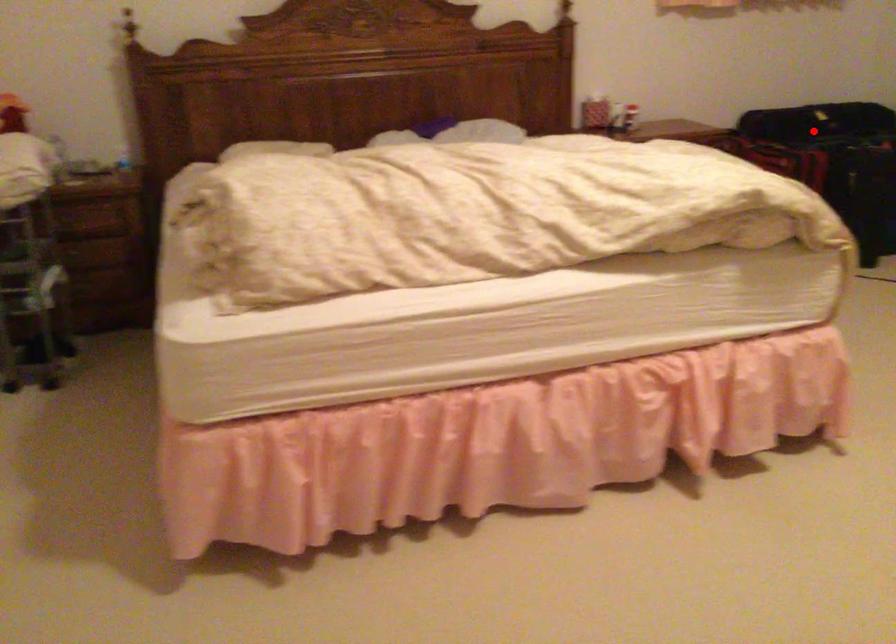
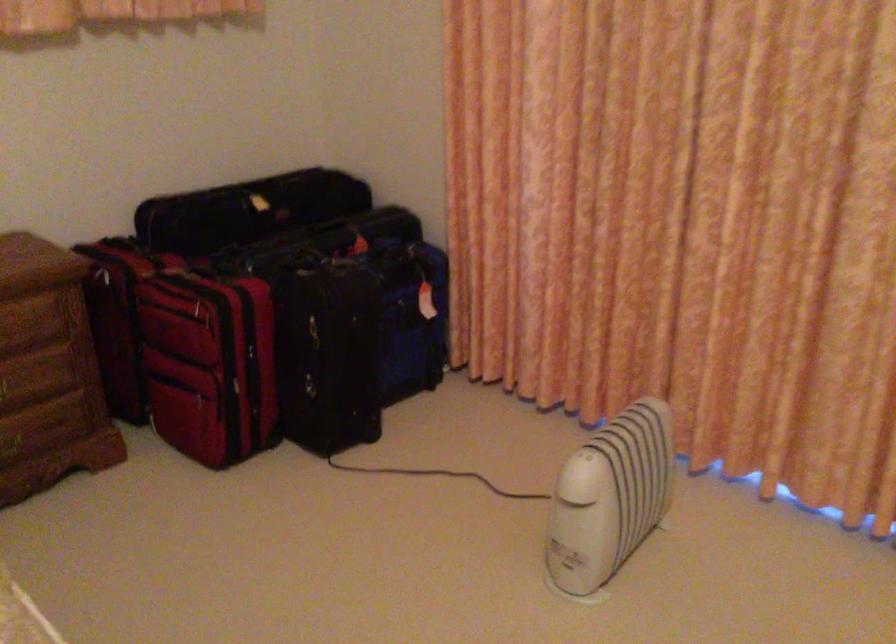
Question: A red point is marked in image1. In image2, is the corresponding 3D point closer to the camera or farther? Reply with the corresponding letter.

Choices:
 (A) The corresponding 3D point is closer.
 (B) The corresponding 3D point is farther.

Answer: (A)